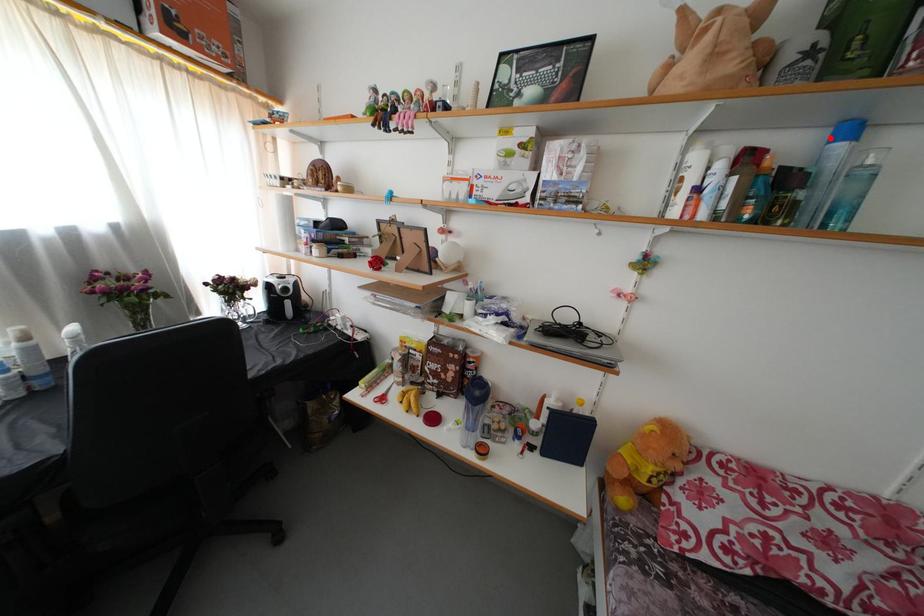
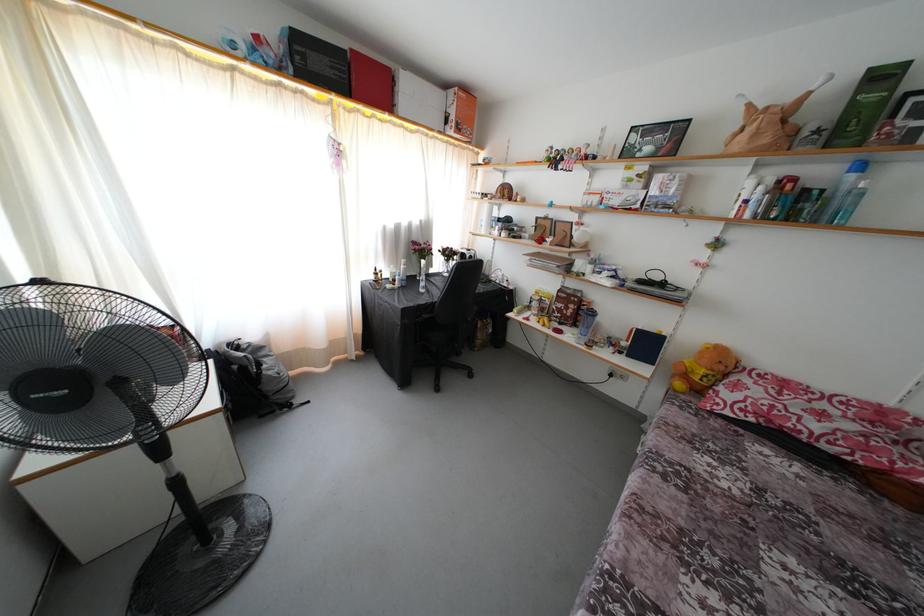
The point at the highlighted location is marked in the first image. Where is the corresponding point in the second image?

(849, 172)